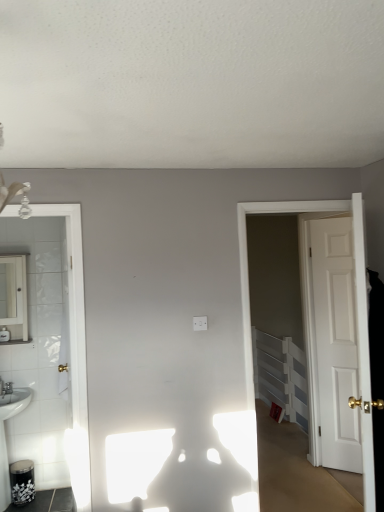
This screenshot has height=512, width=384. Describe the element at coordinates (335, 342) in the screenshot. I see `white matte door at right, the first door from the back` at that location.

Identify the location of white glossy sink at lower left. (5, 436).

You are a GUI agent. You are given a task and a screenshot of the screen. Output one action in this format:
    pyautogui.click(x=<x>, y=<y>)
    Task: Click on the white matte door at right, the 2th door when ordered from left to right
    Image resolution: width=384 pixels, height=512 pixels.
    Given the screenshot: What is the action you would take?
    pyautogui.click(x=335, y=342)

Consider the image. Considering the sizes of objects white glossy sink at lower left and white matte door at right, the 2th door when ordered from left to right, in the image provided, who is bigger, white glossy sink at lower left or white matte door at right, the 2th door when ordered from left to right,?

Bigger between the two is white glossy sink at lower left.

Is white glossy sink at lower left positioned behind white matte door at right, arranged as the 2th door when viewed from the front?

No.

Locate an element on the screen. sink lying below the white matte door at right, the first door from the back (from the image's perspective) is located at coordinates (5, 436).

Is white glossy sink at lower left turned away from white matte door at right, the 2th door when ordered from left to right?

No, white glossy sink at lower left is not facing the opposite direction of white matte door at right, the 2th door when ordered from left to right.

Considering the points (304, 410) and (6, 402), which point is behind, point (304, 410) or point (6, 402)?

The point (304, 410) is farther.

Is white plastic radiator at right bigger or smaller than white glossy sink at lower left?

Considering their sizes, white plastic radiator at right takes up less space than white glossy sink at lower left.

Choose the correct answer: Is white plastic radiator at right inside white glossy sink at lower left or outside it?

The correct answer is: outside.

Does white plastic radiator at right turn towards white glossy sink at lower left?

Yes.

Based on the photo, is white glossy mirror at left next to white matte door at right, the 1th door positioned from the right, and touching it?

No, white glossy mirror at left is not beside white matte door at right, the 1th door positioned from the right.

Which is closer, (0, 303) or (334, 274)?

Point (0, 303) is positioned farther from the camera compared to point (334, 274).

Is white glossy mirror at left positioned in front of white matte door at right, the first door from the back?

Yes, white glossy mirror at left is in front of white matte door at right, the first door from the back.

Locate an element on the screen. door that appears above the white matte door at right, the first door from the back (from a real-world perspective) is located at coordinates (248, 272).

Is point (306, 202) positioned before point (315, 265)?

Yes, it is.

Is white wooden door at right, the first door positioned from the left, positioned beyond the bounds of white matte door at right, the 1th door positioned from the right?

Yes, white wooden door at right, the first door positioned from the left, is not within white matte door at right, the 1th door positioned from the right.

From the image's perspective, is white wooden door at right, the first door positioned from the left, above or below white matte door at right, the first door from the back?

Based on their image positions, white wooden door at right, the first door positioned from the left, is located above white matte door at right, the first door from the back.

Considering the sizes of objects white glossy sink at lower left and white plastic radiator at right in the image provided, who is thinner, white glossy sink at lower left or white plastic radiator at right?

With smaller width is white plastic radiator at right.

Is white glossy sink at lower left behind white plastic radiator at right?

No, white glossy sink at lower left is closer to the camera.

Is white glossy sink at lower left surrounding white plastic radiator at right?

No, white plastic radiator at right is located outside of white glossy sink at lower left.

Based on the photo, between white glossy sink at lower left and white plastic radiator at right, which one has less height?

With less height is white glossy sink at lower left.

In order to click on radiator behind the white matte door at right, the 1th door positioned from the right in this screenshot , I will do `click(281, 375)`.

From a real-world perspective, between white plastic radiator at right and white matte door at right, the 2th door when ordered from left to right, who is vertically lower?

From a 3D spatial view, white plastic radiator at right is below.

How many degrees apart are the facing directions of white plastic radiator at right and white matte door at right, the 2th door when ordered from left to right?

white plastic radiator at right and white matte door at right, the 2th door when ordered from left to right, are facing 45.4 degrees away from each other.

Considering the positions of objects white plastic radiator at right and white matte door at right, the 2th door when ordered from left to right, in the image provided, who is more to the right, white plastic radiator at right or white matte door at right, the 2th door when ordered from left to right,?

From the viewer's perspective, white matte door at right, the 2th door when ordered from left to right, appears more on the right side.

Is white glossy mirror at left in contact with white glossy sink at lower left?

No, white glossy mirror at left is not making contact with white glossy sink at lower left.

Which is behind, white glossy mirror at left or white glossy sink at lower left?

white glossy mirror at left is further away from the camera.

How many degrees apart are the facing directions of white glossy mirror at left and white glossy sink at lower left?

They differ by 0.337 degrees in their facing directions.

Does white glossy mirror at left have a smaller size compared to white glossy sink at lower left?

Yes, white glossy mirror at left is smaller than white glossy sink at lower left.

Image resolution: width=384 pixels, height=512 pixels. Identify the location of the 1st door positioned above the white glossy sink at lower left (from the image's perspective). (335, 342).

Locate an element on the screen. radiator that appears behind the white glossy sink at lower left is located at coordinates (281, 375).

Estimate the real-world distances between objects in this image. Which object is closer to white glossy mirror at left, white plastic radiator at right or white matte door at right, the first door from the back?

Among the two, white matte door at right, the first door from the back, is located nearer to white glossy mirror at left.

When comparing their distances from white glossy mirror at left, does white glossy sink at lower left or white plastic radiator at right seem further?

white plastic radiator at right lies further to white glossy mirror at left than the other object.

Estimate the real-world distances between objects in this image. Which object is closer to white glossy sink at lower left, white glossy mirror at left or white matte door at right, the 1th door positioned from the right?

Among the two, white glossy mirror at left is located nearer to white glossy sink at lower left.

Estimate the real-world distances between objects in this image. Which object is further from white matte door at right, the first door from the back, white glossy mirror at left or white wooden door at right, which ranks as the 2th door in back-to-front order?

white glossy mirror at left is further to white matte door at right, the first door from the back.

Looking at the image, which one is located closer to white glossy sink at lower left, white matte door at right, the first door from the back, or white glossy mirror at left?

white glossy mirror at left lies closer to white glossy sink at lower left than the other object.

When comparing their distances from white glossy sink at lower left, does white wooden door at right, acting as the 2th door starting from the right, or white plastic radiator at right seem closer?

white wooden door at right, acting as the 2th door starting from the right.

From the image, which object appears to be farther from white glossy mirror at left, white plastic radiator at right or white wooden door at right, which ranks as the 2th door in back-to-front order?

white plastic radiator at right.

Estimate the real-world distances between objects in this image. Which object is closer to white matte door at right, the 1th door positioned from the right, white plastic radiator at right or white glossy mirror at left?

white plastic radiator at right is positioned closer to the anchor white matte door at right, the 1th door positioned from the right.

The image size is (384, 512). In order to click on door situated between white glossy mirror at left and white matte door at right, the first door from the back, from left to right in this screenshot , I will do `click(248, 272)`.

Locate an element on the screen. The height and width of the screenshot is (512, 384). sink between white glossy mirror at left and white wooden door at right, the first door positioned from the left, in the horizontal direction is located at coordinates (5, 436).

The height and width of the screenshot is (512, 384). I want to click on door located between white glossy sink at lower left and white matte door at right, the 2th door when ordered from left to right, in the left-right direction, so pyautogui.click(x=248, y=272).

Identify the location of sink between white glossy mirror at left and white plastic radiator at right in the horizontal direction. (5, 436).